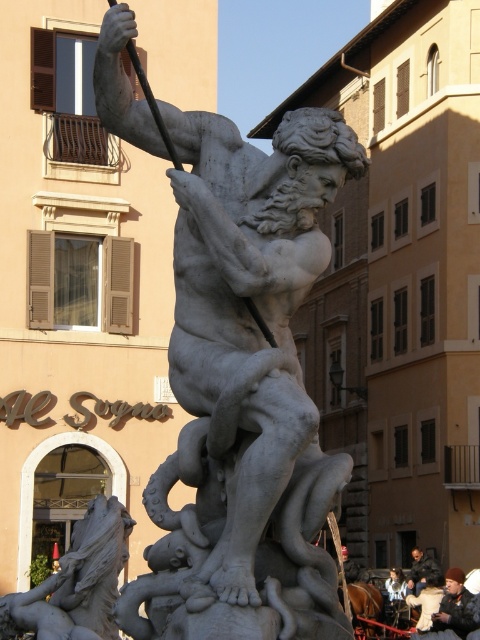
Question: Among these points, which one is nearest to the camera?

Choices:
 (A) (414, 584)
 (B) (245, 269)

Answer: (B)

Question: Does white marble statue at center have a larger size compared to dark brown leather jacket at lower right?

Choices:
 (A) no
 (B) yes

Answer: (B)

Question: Among these points, which one is nearest to the camera?

Choices:
 (A) coord(422,586)
 (B) coord(245,173)

Answer: (B)

Question: Is white marble statue at center wider than dark brown leather jacket at lower right?

Choices:
 (A) no
 (B) yes

Answer: (B)

Question: Can you confirm if white marble statue at center is positioned to the right of dark brown leather jacket at lower right?

Choices:
 (A) yes
 (B) no

Answer: (B)